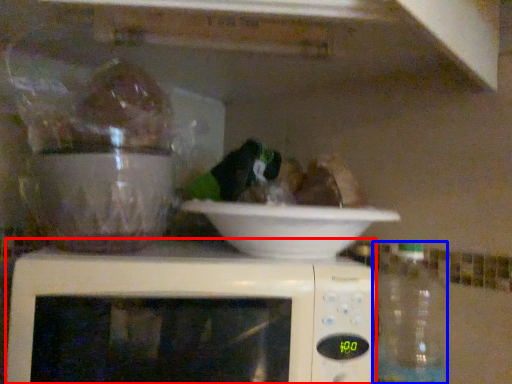
Question: Which object appears farthest to the camera in this image, microwave oven (highlighted by a red box) or bottle (highlighted by a blue box)?

Choices:
 (A) microwave oven
 (B) bottle

Answer: (B)